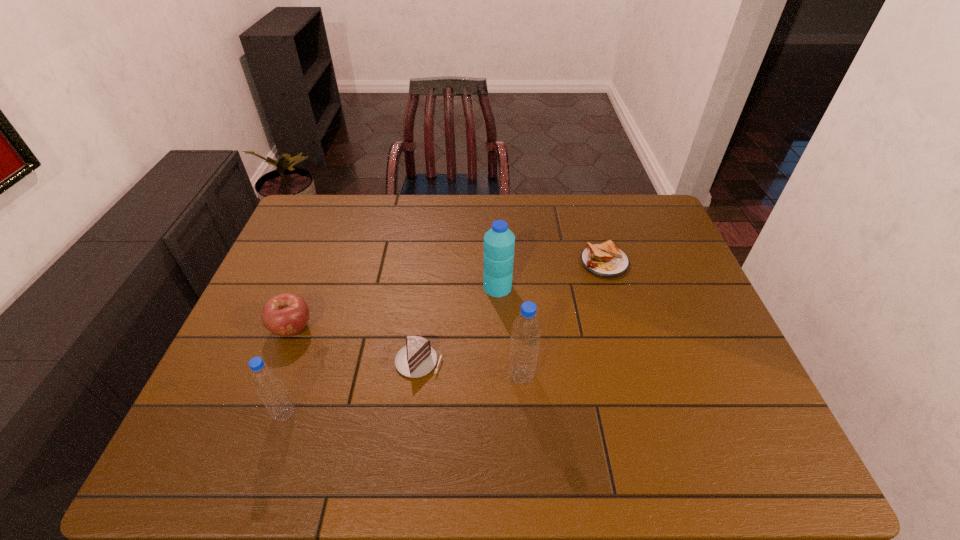
This screenshot has width=960, height=540. I want to click on free space located on the left of the second nearest water bottle, so click(425, 376).

Image resolution: width=960 pixels, height=540 pixels. Find the location of `blank area located 0.250m on the left of the farthest water bottle`. blank area located 0.250m on the left of the farthest water bottle is located at coordinates (397, 287).

Locate an element on the screen. free space located 0.140m on the front of the sandwich is located at coordinates (620, 314).

The image size is (960, 540). Find the location of `vacant region located 0.050m on the right of the chocolate cake`. vacant region located 0.050m on the right of the chocolate cake is located at coordinates (463, 361).

Locate an element on the screen. vacant space located 0.130m on the side of the apple with the unique marking is located at coordinates (268, 390).

At what (x,y) coordinates should I click in order to perform the action: click on object situated at the near edge. Please return your answer as a coordinate pair (x, y). Looking at the image, I should click on (266, 381).

Find the location of `object located at the left edge`. object located at the left edge is located at coordinates (287, 314).

I want to click on vacant position at the far edge of the desktop, so click(x=603, y=231).

Locate an element on the screen. The image size is (960, 540). vacant space at the near edge of the desktop is located at coordinates (523, 389).

Locate an element on the screen. This screenshot has height=540, width=960. vacant space at the left edge is located at coordinates (252, 346).